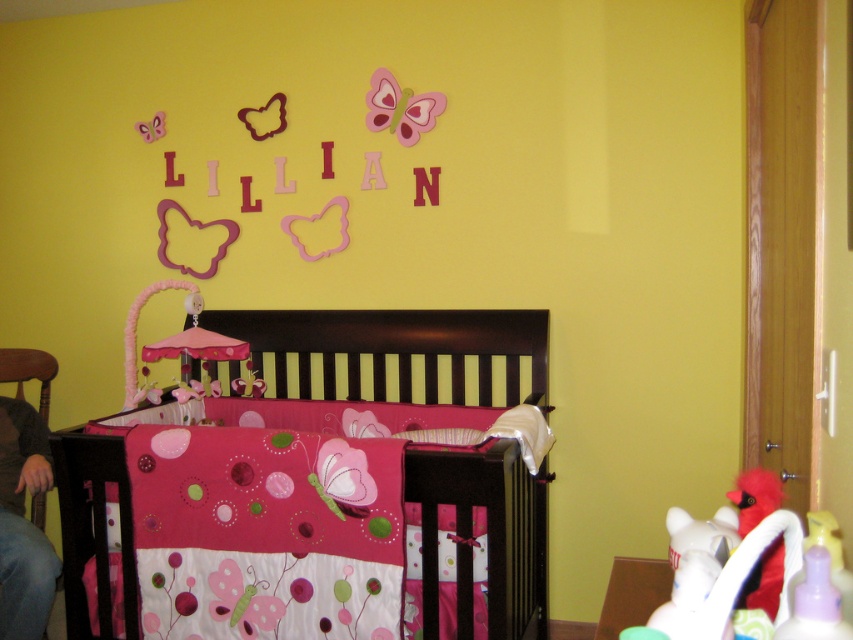
Question: Which point is farther to the camera?

Choices:
 (A) jeans at lower left
 (B) pink fabric crib at center
 (C) brown wooden chair at left
 (D) green plastic changing table at lower right

Answer: (C)

Question: From the image, what is the correct spatial relationship of jeans at lower left in relation to brown wooden chair at left?

Choices:
 (A) right
 (B) left

Answer: (A)

Question: Among these points, which one is farthest from the camera?

Choices:
 (A) (44, 374)
 (B) (67, 538)

Answer: (A)

Question: Which point is closer to the camera taking this photo?

Choices:
 (A) (137, 602)
 (B) (42, 570)
 (C) (22, 374)

Answer: (A)

Question: From the image, what is the correct spatial relationship of pink fabric crib at center in relation to brown wooden chair at left?

Choices:
 (A) left
 (B) right

Answer: (B)

Question: Can you confirm if pink fabric crib at center is wider than green plastic changing table at lower right?

Choices:
 (A) yes
 (B) no

Answer: (A)